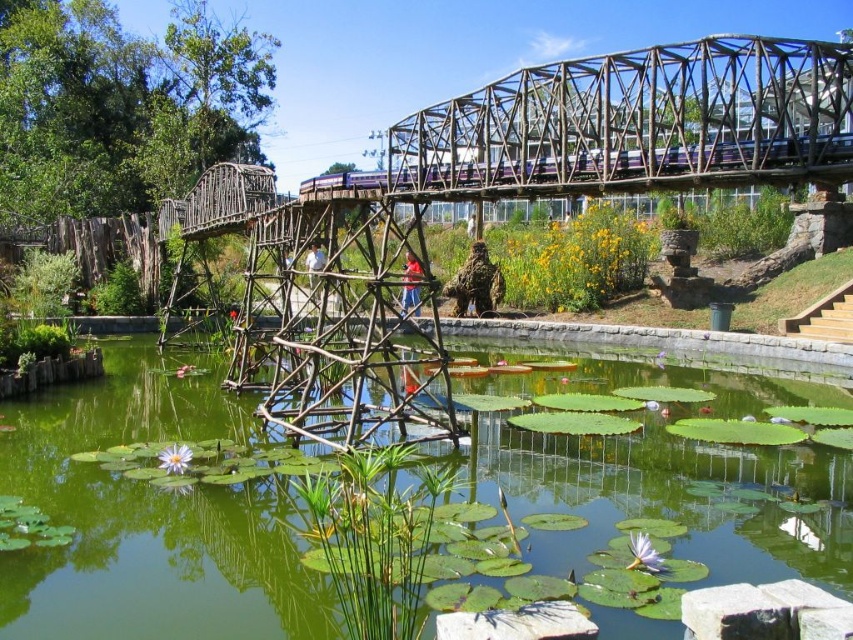
Question: Can you confirm if green lily pads at center is positioned below metallic structure at upper center?

Choices:
 (A) yes
 (B) no

Answer: (A)

Question: Among these objects, which one is farthest from the camera?

Choices:
 (A) green lily pads at center
 (B) metallic structure at upper center

Answer: (B)

Question: Does green lily pads at center appear on the right side of metallic structure at upper center?

Choices:
 (A) no
 (B) yes

Answer: (A)

Question: Which point appears closest to the camera in this image?

Choices:
 (A) (80, 502)
 (B) (392, 392)

Answer: (A)

Question: Is green lily pads at center positioned before metallic structure at upper center?

Choices:
 (A) no
 (B) yes

Answer: (B)

Question: Which object appears closest to the camera in this image?

Choices:
 (A) green lily pads at center
 (B) metallic structure at upper center

Answer: (A)